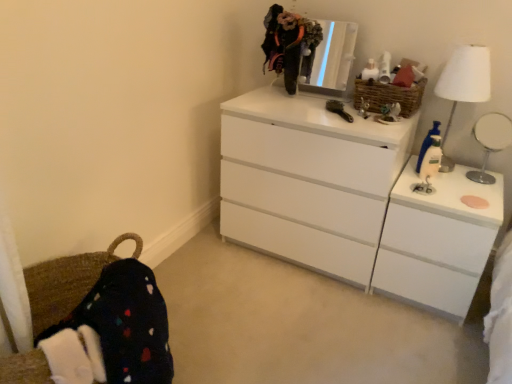
Find the location of a particular element. Image resolution: width=512 pixels, height=384 pixels. free space in front of white glossy mirror at upper right is located at coordinates (487, 195).